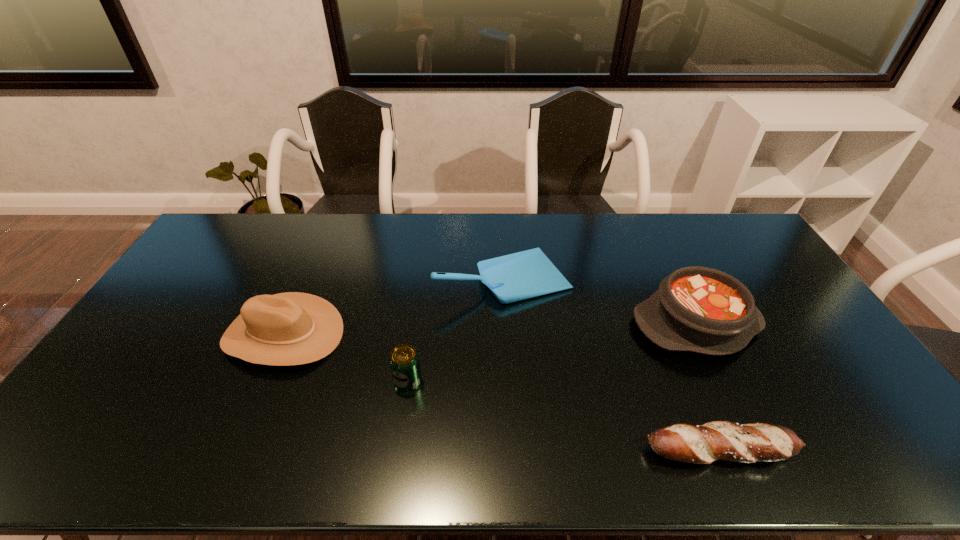
Image resolution: width=960 pixels, height=540 pixels. What are the coordinates of `dustpan` in the screenshot? It's located at (526, 274).

At what (x,y) coordinates should I click in order to perform the action: click on casserole. Please return your answer as a coordinate pair (x, y). The image size is (960, 540). Looking at the image, I should click on (699, 309).

The height and width of the screenshot is (540, 960). Find the location of `the leftmost object`. the leftmost object is located at coordinates (292, 328).

At what (x,y) coordinates should I click in order to perform the action: click on the fourth object from right to left. Please return your answer as a coordinate pair (x, y). Looking at the image, I should click on (404, 361).

Where is `the nearest object`? The width and height of the screenshot is (960, 540). the nearest object is located at coordinates point(717,440).

At what (x,y) coordinates should I click in order to perform the action: click on the shortest object. Please return your answer as a coordinate pair (x, y). The image size is (960, 540). Looking at the image, I should click on (717, 440).

Find the location of a particular element. This screenshot has height=540, width=960. free spot located 0.340m on the left of the third object from left to right is located at coordinates (336, 277).

Find the location of a particular element. vacant space situated 0.150m on the left of the casserole is located at coordinates (582, 323).

Where is `vacant position located 0.230m on the front of the leftmost object`? Image resolution: width=960 pixels, height=540 pixels. vacant position located 0.230m on the front of the leftmost object is located at coordinates (231, 455).

In order to click on vacant space located 0.350m on the left of the beer can in this screenshot , I will do `click(264, 381)`.